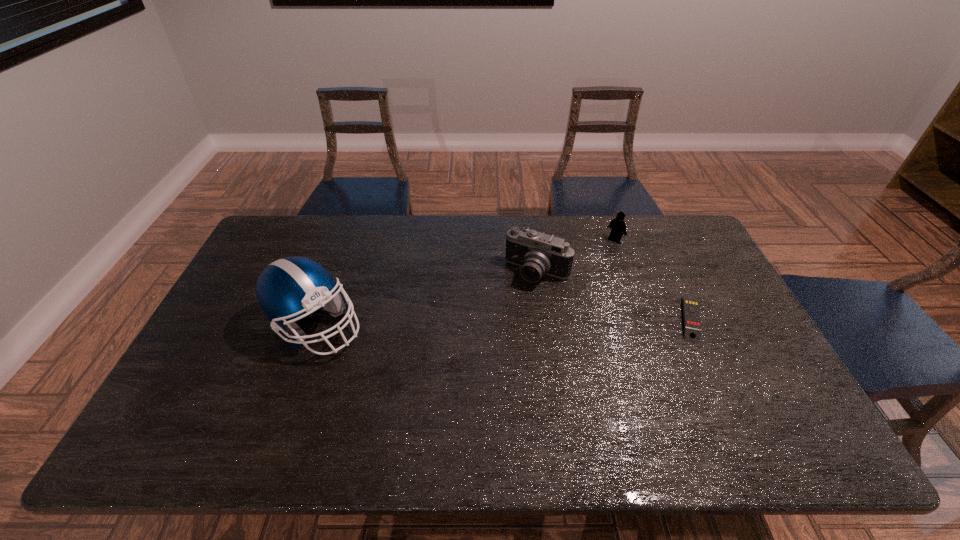
At what (x,y) coordinates should I click in order to perform the action: click on free spot on the desktop that is between the tallest object and the shortest object and is positioned on the face of the third object from left to right. Please return your answer as a coordinate pair (x, y). This screenshot has height=540, width=960. Looking at the image, I should click on (510, 322).

Where is `vacant spot on the desktop that is between the football helmet and the remote control and is positioned on the front-facing side of the second object from left to right`? This screenshot has width=960, height=540. vacant spot on the desktop that is between the football helmet and the remote control and is positioned on the front-facing side of the second object from left to right is located at coordinates (509, 322).